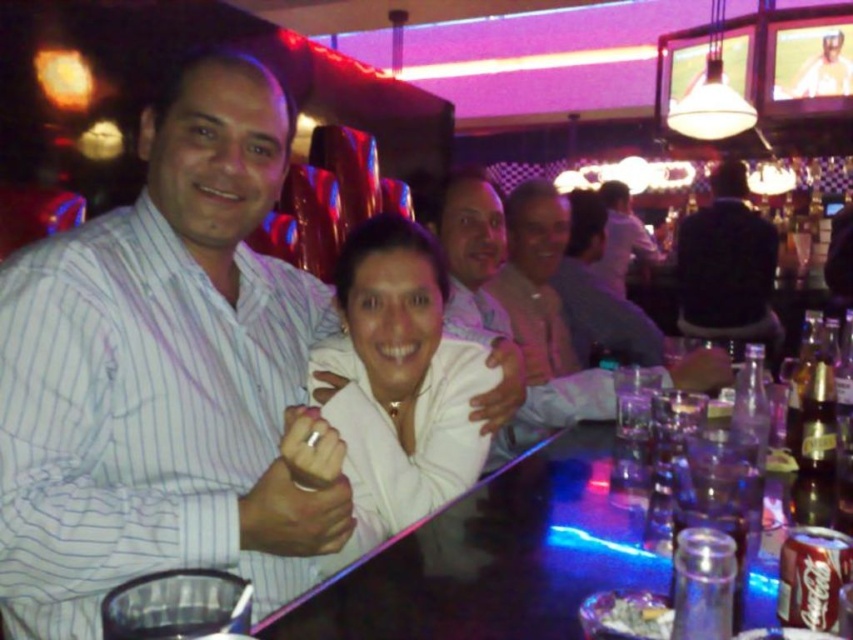
Question: Which of the following is the closest to the observer?

Choices:
 (A) white shirt at center
 (B) clear glass bottle at bar
 (C) black fabric shirt at right
 (D) white striped shirt at center

Answer: (D)

Question: Among these objects, which one is farthest from the camera?

Choices:
 (A) white glossy shirt at center
 (B) white shirt at center

Answer: (B)

Question: Can you confirm if white glossy shirt at center is bigger than clear glass bottle at bar?

Choices:
 (A) yes
 (B) no

Answer: (A)

Question: Can you confirm if white glossy shirt at center is wider than white shirt at center?

Choices:
 (A) yes
 (B) no

Answer: (B)

Question: Does black fabric shirt at right come behind white shirt at center?

Choices:
 (A) no
 (B) yes

Answer: (B)

Question: Considering the real-world distances, which object is farthest from the black fabric shirt at right?

Choices:
 (A) white glossy shirt at center
 (B) clear glass bottle at bar

Answer: (A)